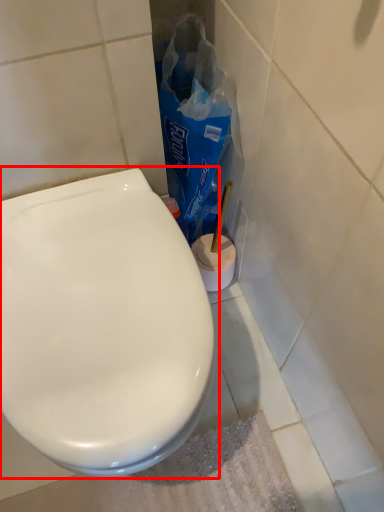
Question: From the image's perspective, considering the relative positions of toilet (annotated by the red box) and paper bag in the image provided, where is toilet (annotated by the red box) located with respect to the staircase?

Choices:
 (A) above
 (B) below

Answer: (B)